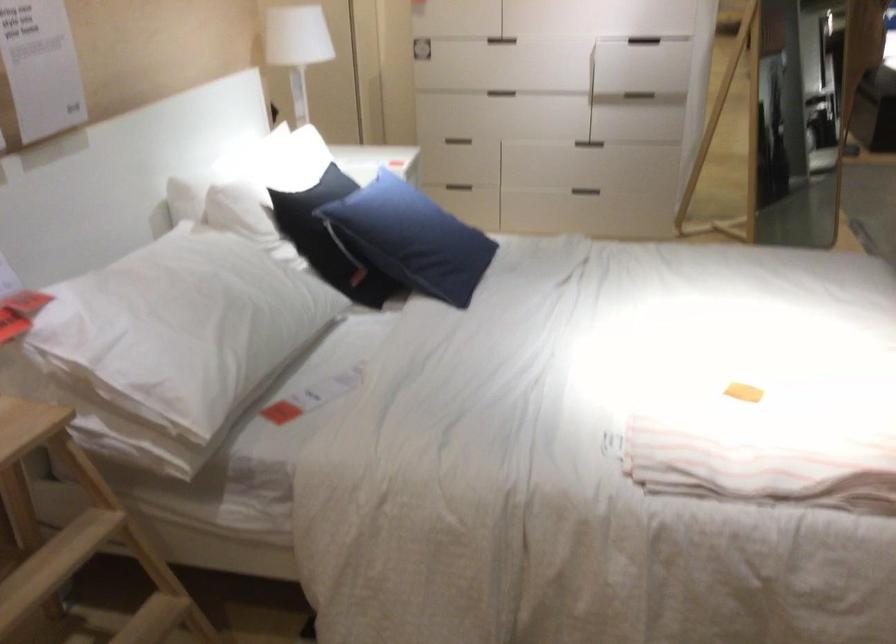
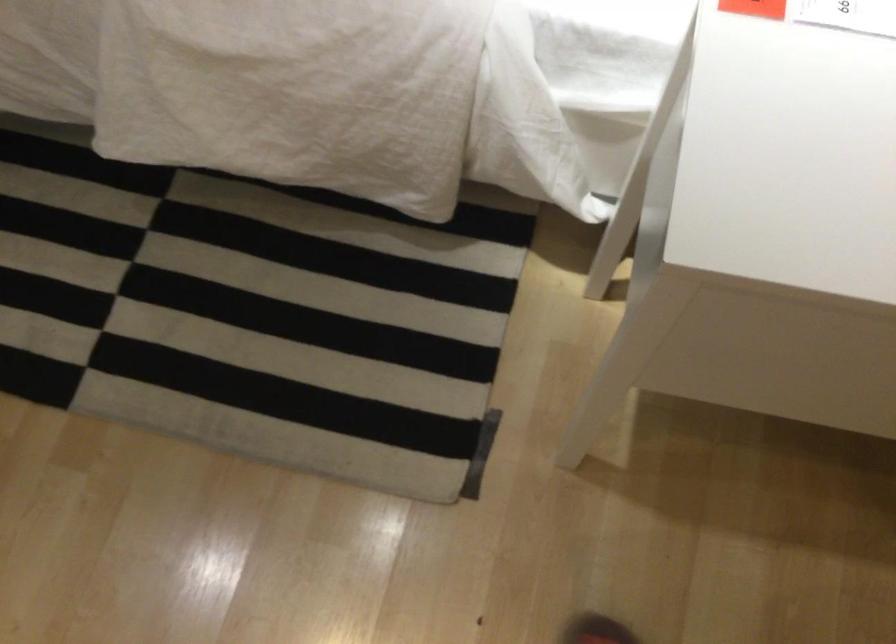
In the second image, find the point that corresponds to pixel 405 164 in the first image.

(754, 8)